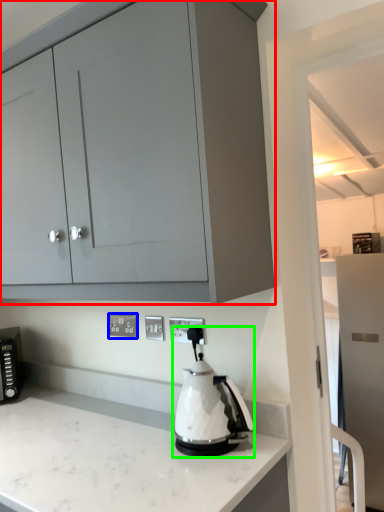
Question: Which is nearer to the cabinetry (highlighted by a red box)? electric outlet (highlighted by a blue box) or kitchen appliance (highlighted by a green box).

Choices:
 (A) electric outlet
 (B) kitchen appliance

Answer: (B)